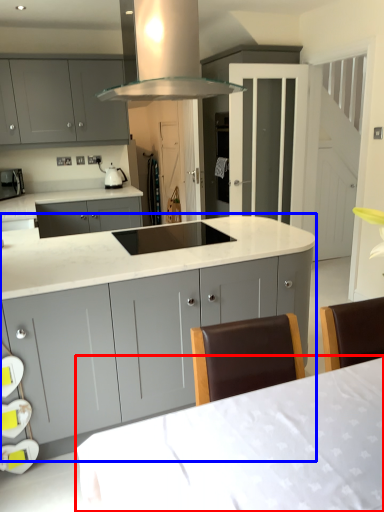
Question: Which point is further to the camera, table (highlighted by a red box) or cabinetry (highlighted by a blue box)?

Choices:
 (A) table
 (B) cabinetry

Answer: (B)